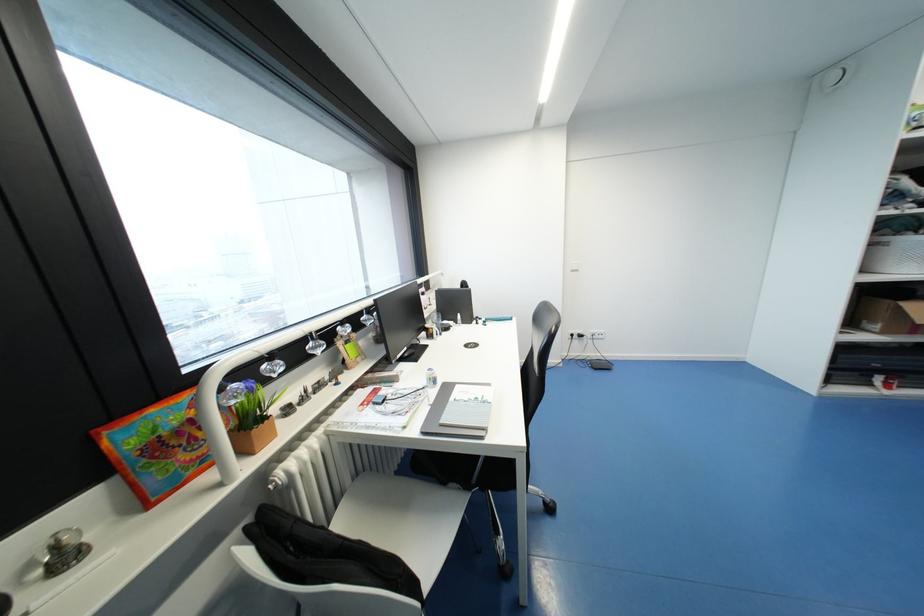
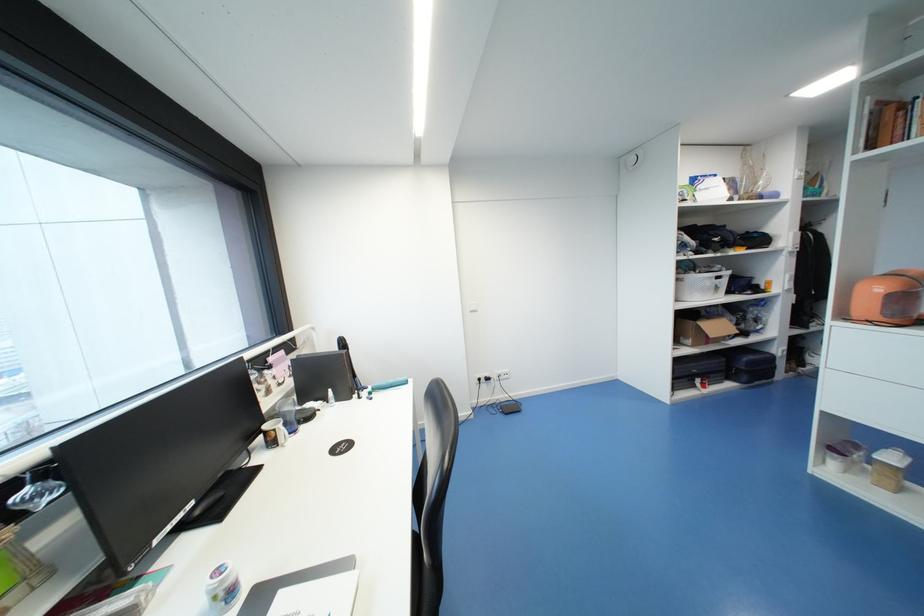
Question: The camera is either moving clockwise (left) or counter-clockwise (right) around the object. The first image is from the beginning of the video and the second image is from the end. Is the camera moving left or right when shooting the video?

Choices:
 (A) Left
 (B) Right

Answer: (A)